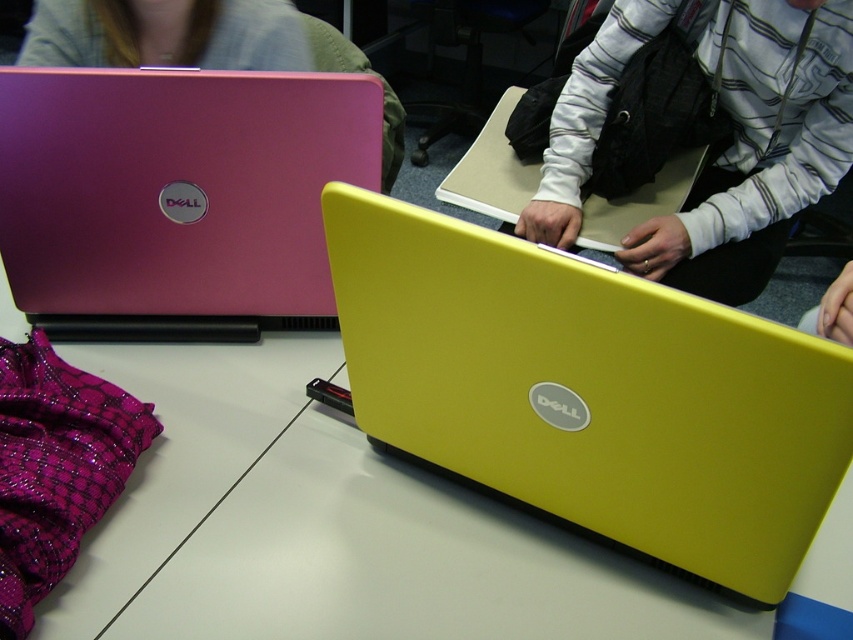
Based on the photo, you are a student sitting at a desk in a classroom. You need to locate the yellow matte laptop at center. Can you tell me its coordinates based on the image?

The yellow matte laptop at center is located at coordinates point [590,392].

You are organizing a tech fair and need to stack the yellow matte laptop at center and the matte pink laptop at upper left vertically. Which one should go on the bottom to ensure stability?

The matte pink laptop at upper left should go on the bottom because it is thicker than the yellow matte laptop at center, providing a more stable base for stacking.

You are a photographer setting up a shot of the yellow matte laptop at center. You need to position your camera so that it is exactly 24 inches away from the laptop. Based on the current distance, should you move the camera closer or farther away?

The yellow matte laptop at center is currently 21.29 inches away from the camera. To reach the desired 24 inches, you need to move the camera farther away by approximately 2.71 inches.